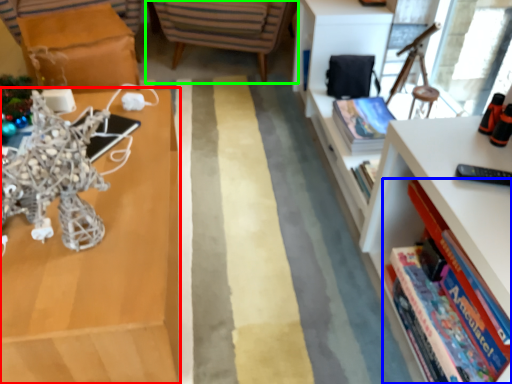
Question: Which object is the farthest from shelf (highlighted by a red box)? Choose among these: book (highlighted by a blue box) or chair (highlighted by a green box).

Choices:
 (A) book
 (B) chair

Answer: (B)